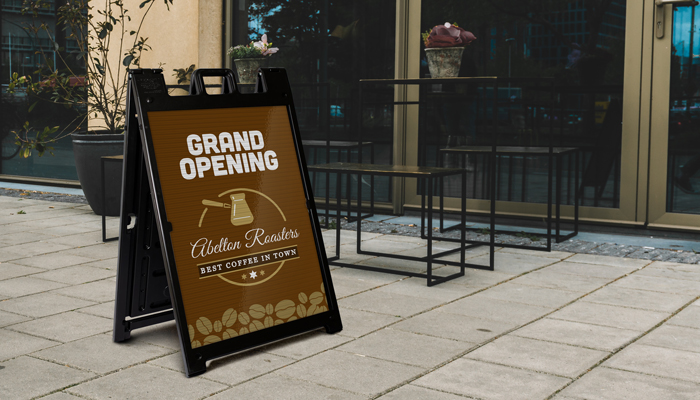
You are a GUI agent. You are given a task and a screenshot of the screen. Output one action in this format:
    pyautogui.click(x=<x>, y=<y>)
    Task: Click on the table stand
    This screenshot has height=400, width=700.
    Given the screenshot: What is the action you would take?
    pyautogui.click(x=395, y=191)